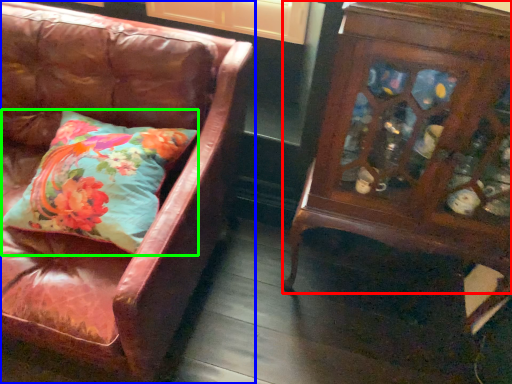
Question: Which is nearer to the furniture (highlighted by a red box)? chair (highlighted by a blue box) or pillow (highlighted by a green box).

Choices:
 (A) chair
 (B) pillow

Answer: (A)